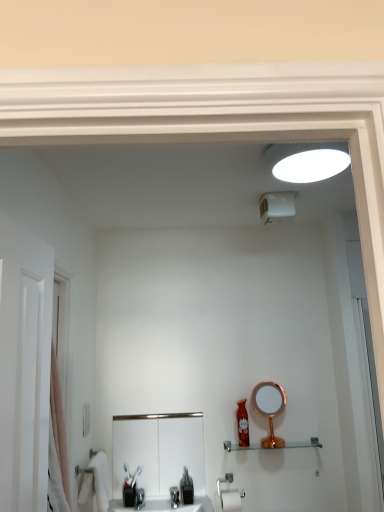
Question: Do you think black plastic soap dispenser at lower center is within matte red bottle at center, or outside of it?

Choices:
 (A) inside
 (B) outside

Answer: (B)

Question: From the image's perspective, relative to matte red bottle at center, is black plastic soap dispenser at lower center above or below?

Choices:
 (A) below
 (B) above

Answer: (A)

Question: Which object is the closest to the white soft towel at lower left?

Choices:
 (A) black plastic soap dispenser at lower center
 (B) satin nickel sink at center
 (C) clear glass shelf at center
 (D) rose gold metallic mirror at lower right
 (E) pink fabric shower curtain at left

Answer: (B)

Question: Considering the real-world distances, which object is farthest from the rose gold metallic mirror at lower right?

Choices:
 (A) black plastic soap dispenser at lower center
 (B) clear glass shelf at center
 (C) matte red bottle at center
 (D) pink fabric shower curtain at left
 (E) satin nickel sink at center

Answer: (D)